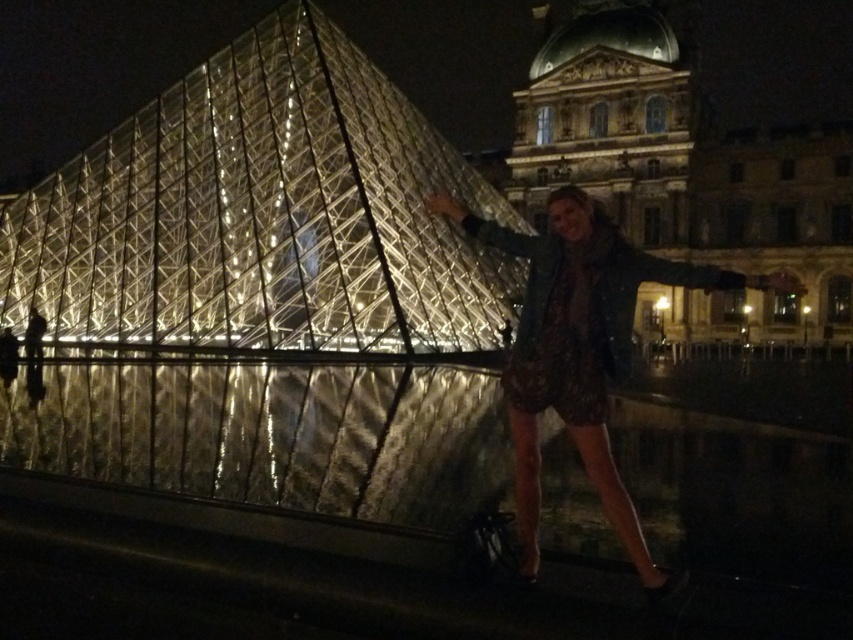
You are standing in front of the Louvre Museum at night. You see the transparent glass pyramid at center and the patterned fabric dress at center. Which object appears taller in the scene?

The transparent glass pyramid at center is much taller than the patterned fabric dress at center.

You are a photographer standing at the point marked as point (578, 349) in the image. You want to capture a photo of the patterned fabric dress at center. Is the patterned fabric dress at center visible from your current position?

The patterned fabric dress at center is located at point (578, 349), so yes, it is visible from your current position.

You are standing in front of the Louvre Museum at night. You want to take a photo of the transparent glass pyramid at center. If your camera has a maximum focus range of 100 meters, will you be able to capture the pyramid clearly?

The transparent glass pyramid at center is 99.46 meters away from the viewer. Since the camera can focus up to 100 meters, it is within the range, so yes, you can capture the pyramid clearly.